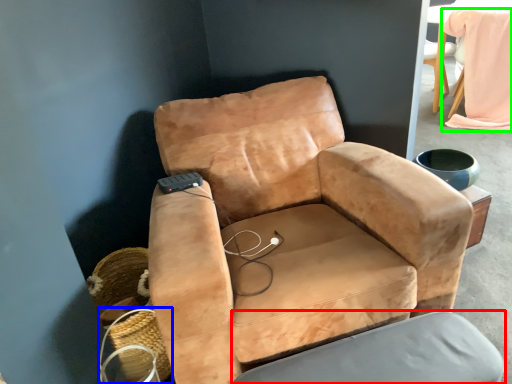
Question: Which is farther away from swivel chair (highlighted by a red box)? basket (highlighted by a blue box) or bean bag chair (highlighted by a green box)?

Choices:
 (A) basket
 (B) bean bag chair

Answer: (B)